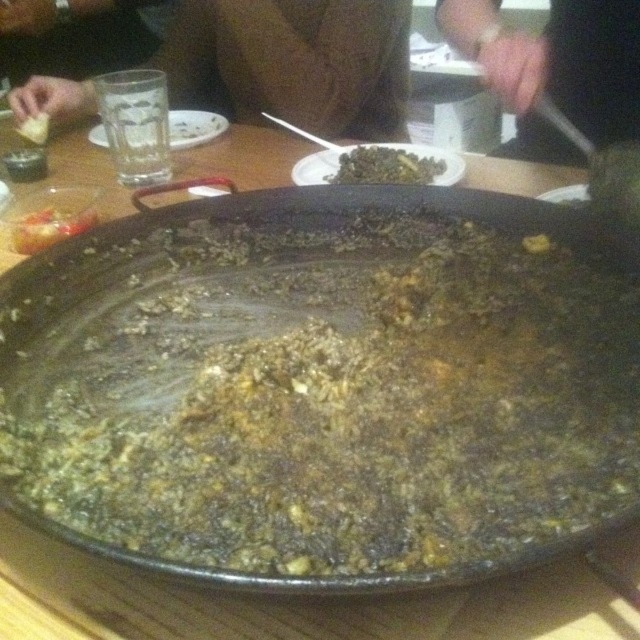
You are a guest at a dinner party and want to place your napkin on the table. You see two points on the table labeled as point (428, 170) and point (20, 124). If you want to place your napkin closer to the edge of the table, which point should you choose?

Point (20, 124) is closer to the edge of the table because it is behind point (428, 170).

You are a chef preparing to serve a dish. You have a black matte wok at center and a shiny plastic fork at upper left. Which object should you use to transfer the food from the pan to a plate?

The black matte wok at center is bigger than the shiny plastic fork at upper left, so the chef should use the shiny plastic fork at upper left to transfer the food because it is the appropriate utensil for serving, while the wok is likely the cooking vessel.